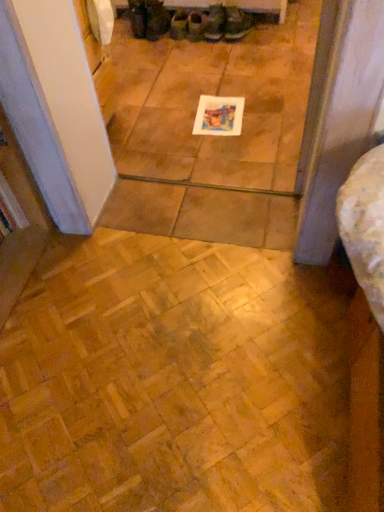
Identify the location of free spot to the left of white paper at center. (175, 122).